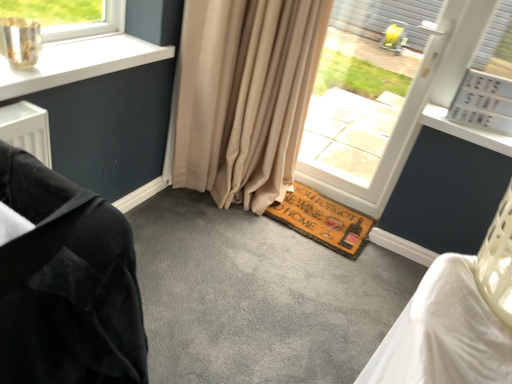
At what (x,y) coordinates should I click in order to perform the action: click on vacant space in front of brown coir doormat at lower center. Please return your answer as a coordinate pair (x, y). Looking at the image, I should click on (280, 278).